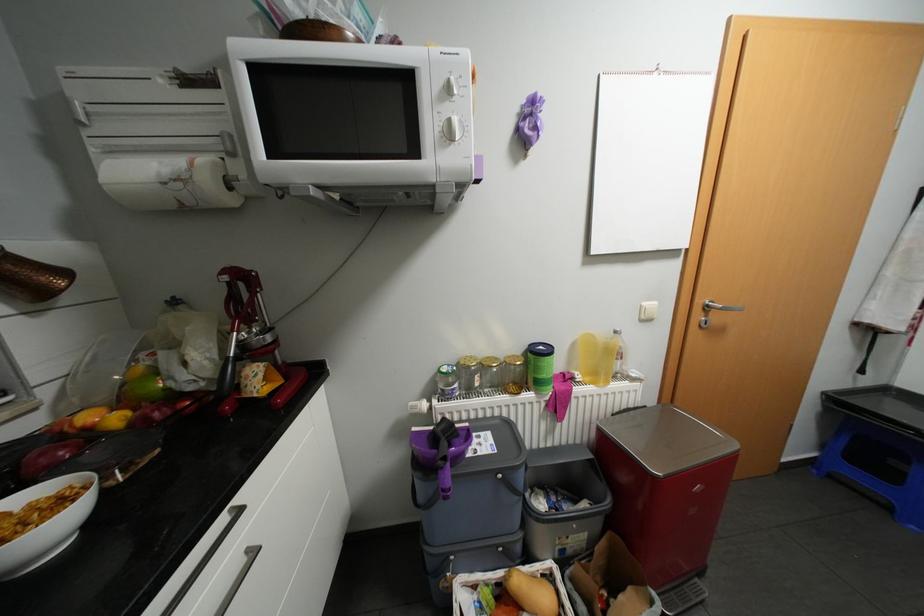
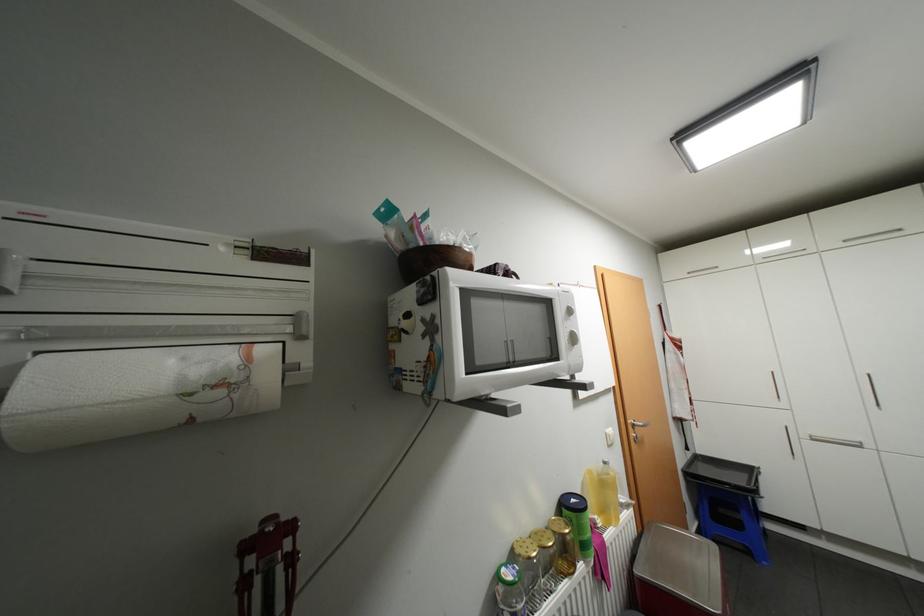
Locate, in the second image, the point that corresponds to (x=549, y=346) in the first image.

(580, 499)